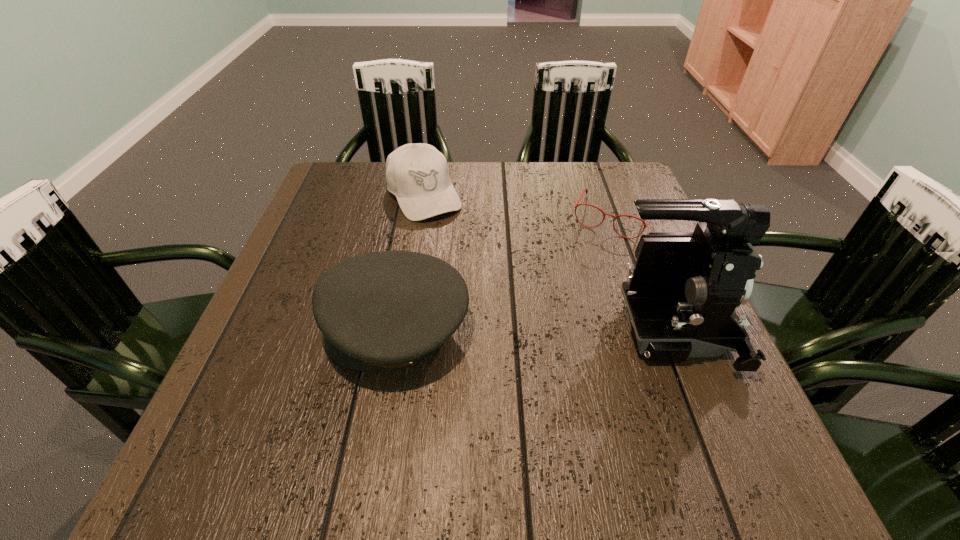
Where is `vacant space located 0.140m on the front-facing side of the baseball cap`? vacant space located 0.140m on the front-facing side of the baseball cap is located at coordinates (458, 254).

In order to click on blank area located 0.140m on the front-facing side of the baseball cap in this screenshot , I will do `click(458, 254)`.

Where is `spectacles that is at the far edge`? This screenshot has height=540, width=960. spectacles that is at the far edge is located at coordinates (645, 225).

Identify the location of baseball cap situated at the far edge. The height and width of the screenshot is (540, 960). (417, 174).

Where is `object located at the near edge`? Image resolution: width=960 pixels, height=540 pixels. object located at the near edge is located at coordinates (381, 310).

Where is `object that is at the left edge`? The height and width of the screenshot is (540, 960). object that is at the left edge is located at coordinates (381, 310).

What are the coordinates of `camcorder at the right edge` in the screenshot? It's located at (681, 298).

Locate an element on the screen. spectacles that is at the right edge is located at coordinates (645, 225).

Locate an element on the screen. object positioned at the near left corner is located at coordinates (381, 310).

The height and width of the screenshot is (540, 960). What are the coordinates of `object that is at the far right corner` in the screenshot? It's located at (645, 225).